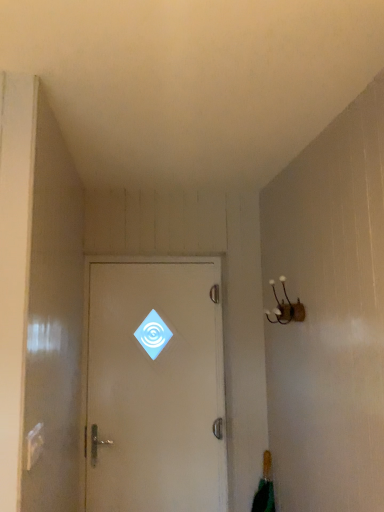
This screenshot has width=384, height=512. What do you see at coordinates (155, 385) in the screenshot? I see `white glossy door at center` at bounding box center [155, 385].

Locate an element on the screen. The image size is (384, 512). white glossy door at center is located at coordinates (155, 385).

In order to face white glossy door at center, should I rotate leftwards or rightwards?

Rotate your view left by about 5.238°.

The width and height of the screenshot is (384, 512). Find the location of `white glossy door at center`. white glossy door at center is located at coordinates pos(155,385).